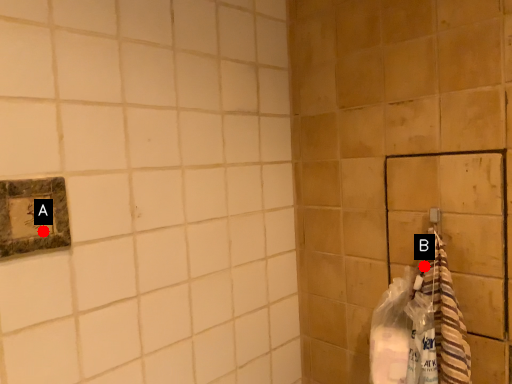
Question: Two points are circled on the image, labeled by A and B beside each circle. Which point is farther from the camera taking this photo?

Choices:
 (A) A is further
 (B) B is further

Answer: (B)